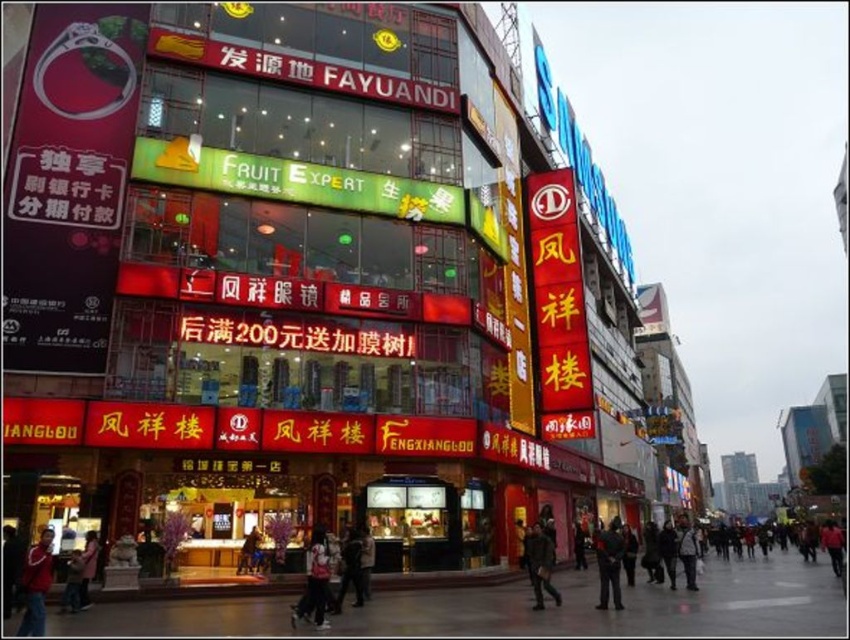
Question: Which point appears closest to the camera in this image?

Choices:
 (A) (31, 611)
 (B) (608, 532)

Answer: (A)

Question: Is dark gray jacket at lower center positioned at the back of dark gray jacket at lower right?

Choices:
 (A) yes
 (B) no

Answer: (B)

Question: Which object is closer to the camera taking this photo?

Choices:
 (A) red sweater at lower left
 (B) dark gray jacket at lower right
 (C) dark gray jacket at lower center

Answer: (A)

Question: From the image, what is the correct spatial relationship of red sweater at lower left in relation to dark gray jacket at lower right?

Choices:
 (A) right
 (B) left

Answer: (B)

Question: Which point is closer to the camera taking this photo?

Choices:
 (A) (552, 547)
 (B) (605, 540)

Answer: (A)

Question: Considering the relative positions of red sweater at lower left and dark gray jacket at lower right in the image provided, where is red sweater at lower left located with respect to dark gray jacket at lower right?

Choices:
 (A) left
 (B) right

Answer: (A)